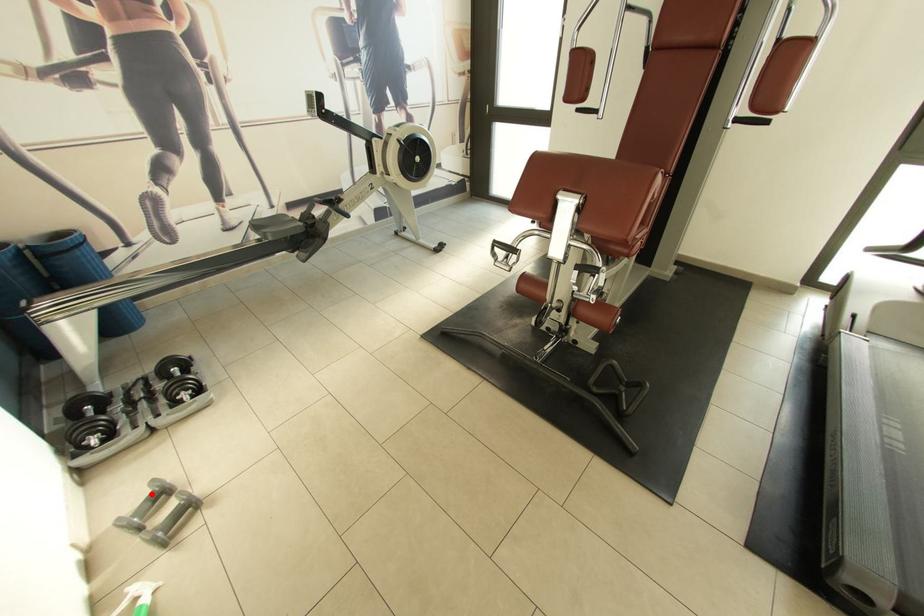
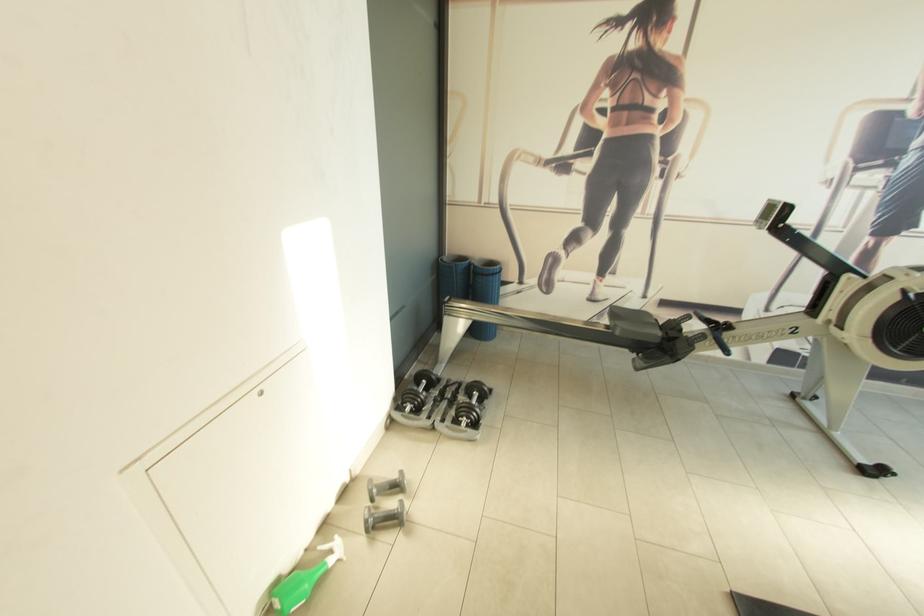
Where in the second image is the point corresponding to the highlighted location from the first image?

(398, 477)